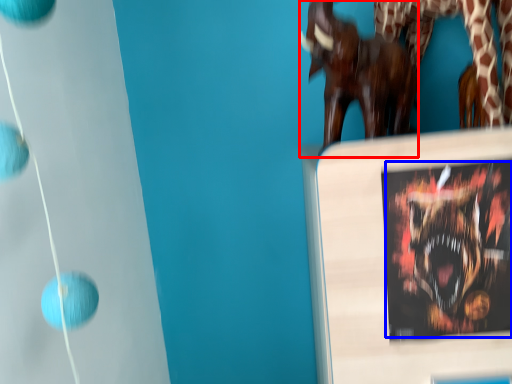
Question: Among these objects, which one is farthest to the camera, sculpture (highlighted by a red box) or animal (highlighted by a blue box)?

Choices:
 (A) sculpture
 (B) animal

Answer: (A)